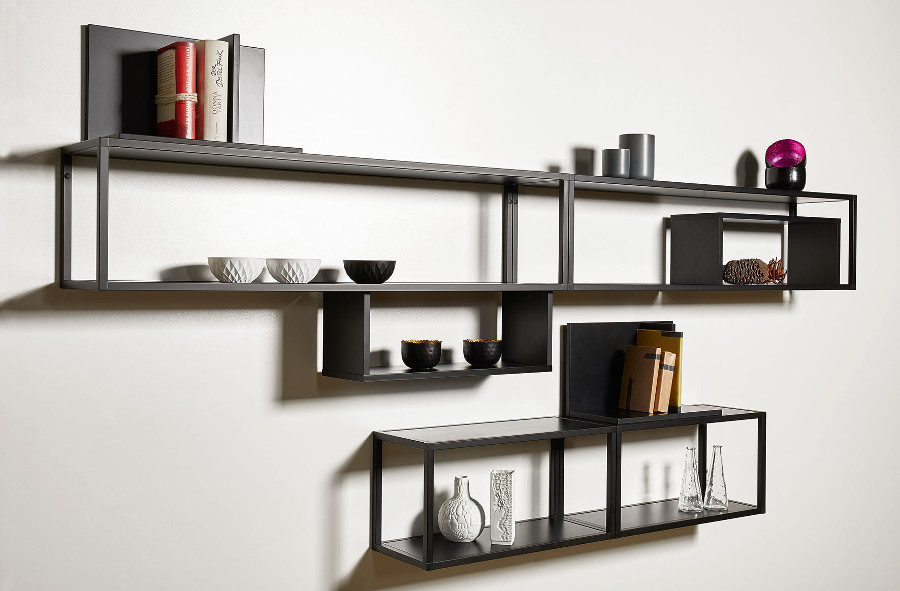
At what (x,y) coordinates should I click in order to perform the action: click on bowls. Please return your answer as a coordinate pair (x, y). Looking at the image, I should click on (432, 357), (486, 344), (374, 269), (285, 266), (227, 268).